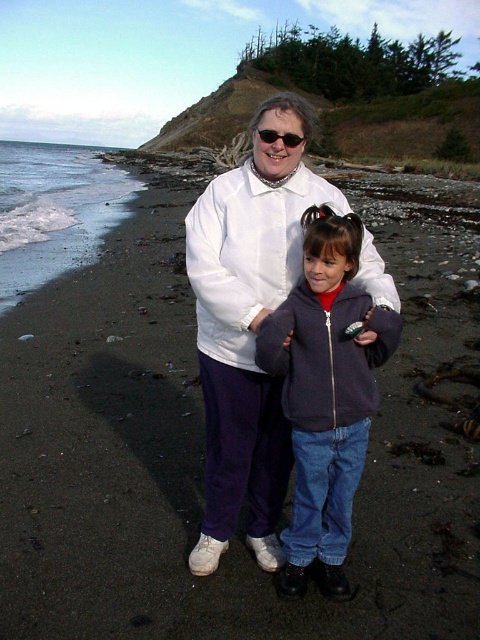
Does point (359, 227) come closer to viewer compared to point (264, 140)?

Yes, point (359, 227) is in front of point (264, 140).

In the scene shown: Who is higher up, dark gray fleece jacket at center or matte black sunglasses at center?

matte black sunglasses at center is higher up.

In order to click on dark gray fleece jacket at center in this screenshot , I will do `click(325, 394)`.